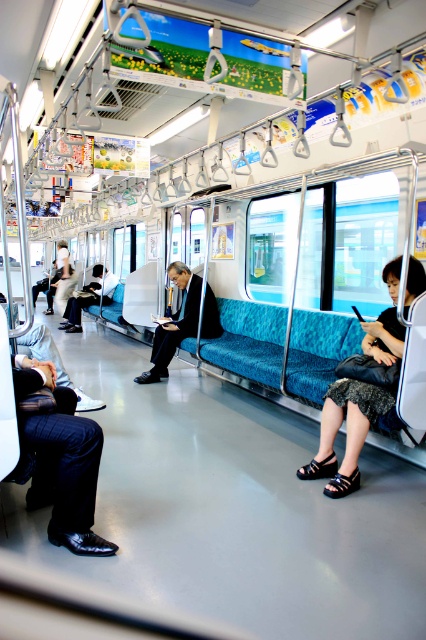
Does shiny black shoe at lower left have a lesser height compared to smooth leather coat at center?

Yes, shiny black shoe at lower left is shorter than smooth leather coat at center.

Does shiny black shoe at lower left have a greater height compared to smooth leather coat at center?

In fact, shiny black shoe at lower left may be shorter than smooth leather coat at center.

Is point (54, 400) closer to viewer compared to point (169, 358)?

Yes, it is in front of point (169, 358).

This screenshot has width=426, height=640. I want to click on shiny black shoe at lower left, so click(57, 456).

Can you confirm if smooth leather coat at center is positioned below matte black jacket at center?

Yes.

Measure the distance from smooth leather coat at center to matte black jacket at center.

smooth leather coat at center is 4.17 meters away from matte black jacket at center.

Locate an element on the screen. Image resolution: width=426 pixels, height=640 pixels. smooth leather coat at center is located at coordinates (175, 323).

Is black leather skirt at lower right smaller than smooth leather coat at center?

Yes, black leather skirt at lower right is smaller than smooth leather coat at center.

Is black leather skirt at lower right to the left of smooth leather coat at center from the viewer's perspective?

No, black leather skirt at lower right is not to the left of smooth leather coat at center.

Where is `black leather skirt at lower right`? black leather skirt at lower right is located at coordinates tap(345, 433).

Locate an element on the screen. Image resolution: width=426 pixels, height=640 pixels. black leather skirt at lower right is located at coordinates (345, 433).